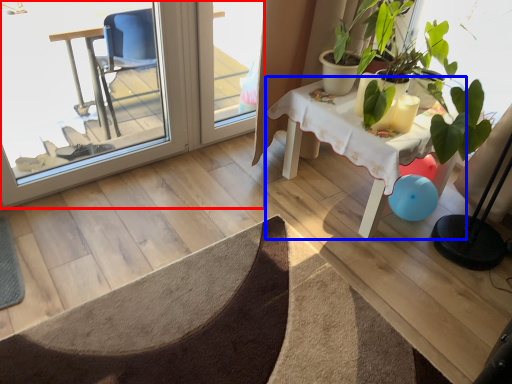
Question: Which object is closer to the camera taking this photo, screen door (highlighted by a red box) or table (highlighted by a blue box)?

Choices:
 (A) screen door
 (B) table

Answer: (A)